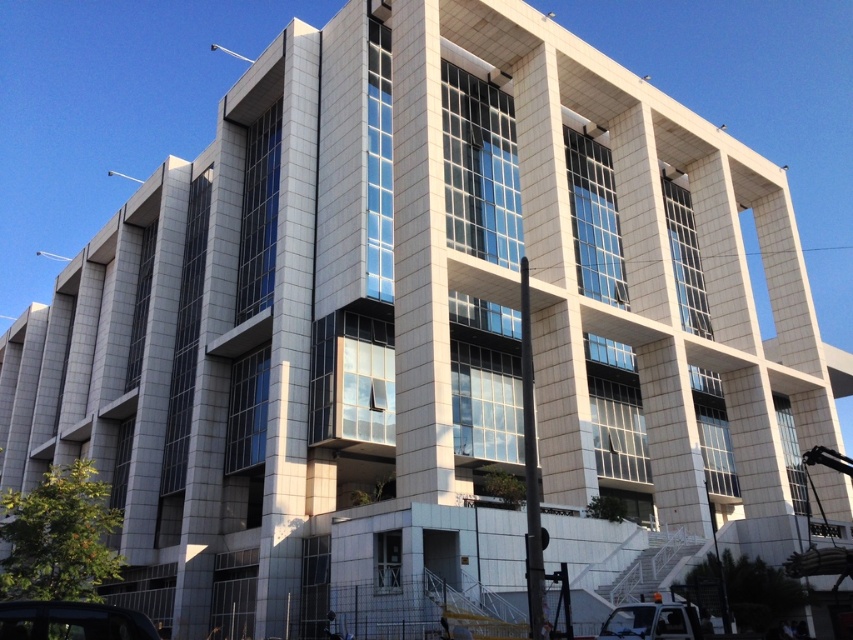
Looking at this image, you are standing at the main entrance of the building. Which direction should you walk to reach the shiny black car at lower left?

You should walk towards the lower left direction to reach the shiny black car at lower left as it is located at point (71, 621).

You are standing at the base of the modern multi story building. You want to reach a specific point marked at point (32, 625). Given that the distance between you and this point is 56.27 feet, can you estimate how far you need to walk to reach it?

The distance between you and the point (32, 625) is 56.27 feet, so you need to walk approximately 56.27 feet to reach it.

You are standing at the entrance of the modern multi story building and see a shiny black car at lower left. What is the location of the point with coordinates (71, 621) in relation to the shiny black car at lower left?

The point with coordinates (71, 621) is located on the shiny black car at lower left.